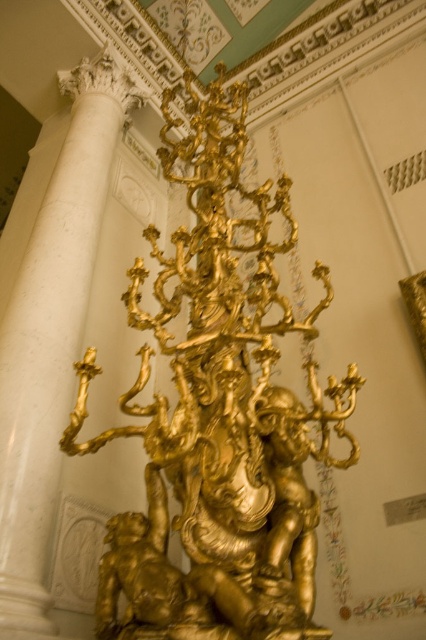
Question: Can you confirm if gold polished statue at center is positioned to the right of white marble column at left?

Choices:
 (A) no
 (B) yes

Answer: (B)

Question: Does gold polished statue at center have a greater width compared to white marble column at left?

Choices:
 (A) no
 (B) yes

Answer: (A)

Question: Which of the following is the farthest from the observer?

Choices:
 (A) (256, 273)
 (B) (83, 140)

Answer: (B)

Question: Does gold polished statue at center appear under white marble column at left?

Choices:
 (A) yes
 (B) no

Answer: (A)

Question: Which of the following is the closest to the observer?

Choices:
 (A) (181, 374)
 (B) (118, 122)

Answer: (A)